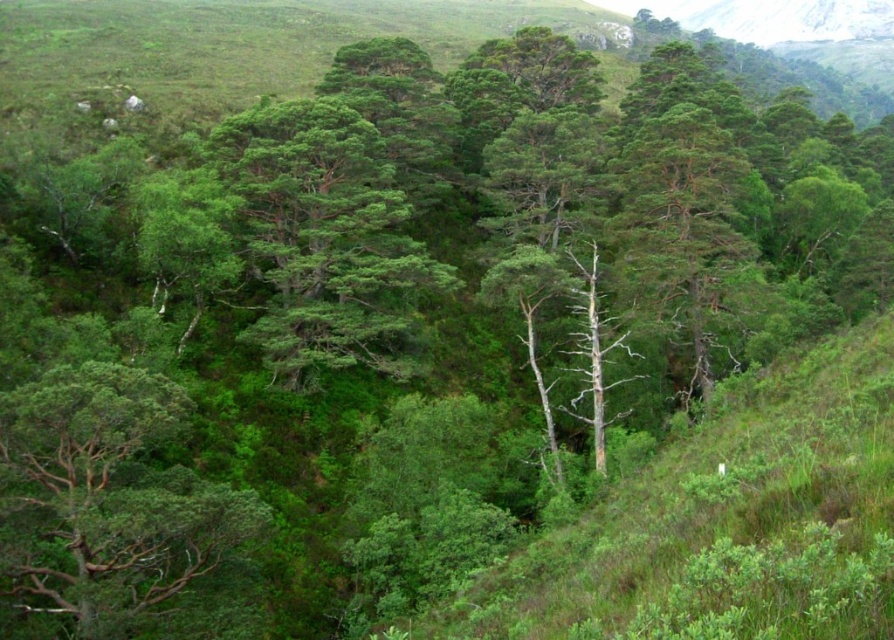
Between green needle-like foliage at center and green rough bark tree at center, which one appears on the right side from the viewer's perspective?

green rough bark tree at center

Which of these two, green needle-like foliage at center or green rough bark tree at center, stands taller?

Standing taller between the two is green needle-like foliage at center.

Is point (395, 195) behind point (703, 198)?

No, (395, 195) is closer to viewer.

Find the location of `green needle-like foliage at center`. green needle-like foliage at center is located at coordinates 325,241.

Does brown rough bark tree at lower left lie in front of green rough bark tree at center?

Yes, it is in front of green rough bark tree at center.

At what (x,y) coordinates should I click in order to perform the action: click on brown rough bark tree at lower left. Please return your answer as a coordinate pair (x, y). The image size is (894, 640). Looking at the image, I should click on (105, 497).

Between point (49, 586) and point (335, 282), which one is positioned behind?

The point (335, 282) is behind.

How much distance is there between brown rough bark tree at lower left and green needle-like foliage at center?

brown rough bark tree at lower left is 25.93 meters from green needle-like foliage at center.

Is point (135, 563) less distant than point (285, 346)?

Yes, it is in front of point (285, 346).

I want to click on brown rough bark tree at lower left, so click(x=105, y=497).